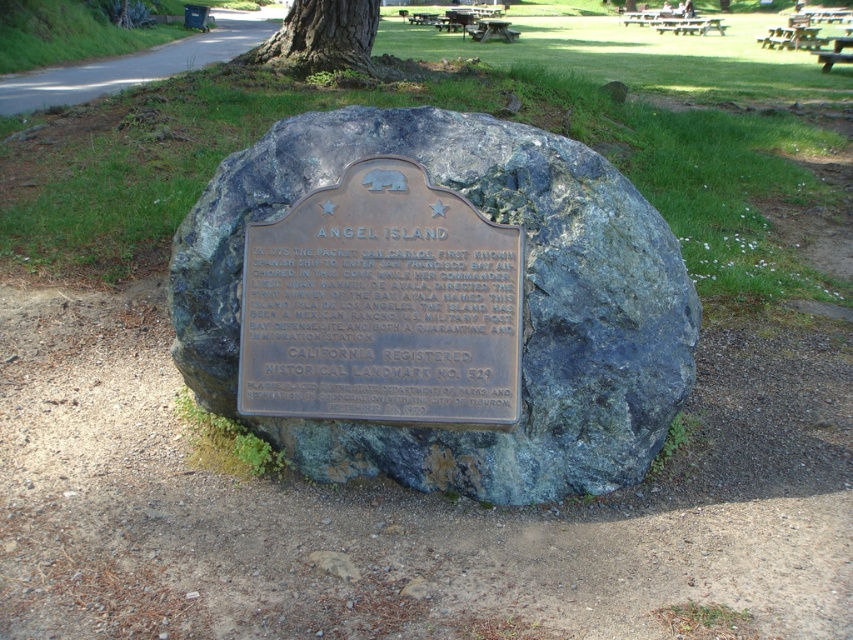
Who is higher up, greenish-blue rock at center or bronze plaque at center?

greenish-blue rock at center

Does greenish-blue rock at center appear on the right side of bronze plaque at center?

Correct, you'll find greenish-blue rock at center to the right of bronze plaque at center.

Is point (613, 488) behind point (372, 237)?

Yes.

This screenshot has width=853, height=640. Find the location of `greenish-blue rock at center`. greenish-blue rock at center is located at coordinates (523, 305).

In the scene shown: Which is below, greenish-blue rock at center or smooth bark tree at center?

Positioned lower is greenish-blue rock at center.

Can you confirm if greenish-blue rock at center is smaller than smooth bark tree at center?

Yes, greenish-blue rock at center is smaller than smooth bark tree at center.

Which is in front, point (663, 369) or point (355, 42)?

Positioned in front is point (663, 369).

The width and height of the screenshot is (853, 640). I want to click on greenish-blue rock at center, so click(523, 305).

Can you confirm if bronze plaque at center is wider than smooth bark tree at center?

In fact, bronze plaque at center might be narrower than smooth bark tree at center.

Based on the photo, who is shorter, bronze plaque at center or smooth bark tree at center?

bronze plaque at center is shorter.

At what (x,y) coordinates should I click in order to perform the action: click on bronze plaque at center. Please return your answer as a coordinate pair (x, y). This screenshot has height=640, width=853. Looking at the image, I should click on (381, 317).

This screenshot has height=640, width=853. What are the coordinates of `bronze plaque at center` in the screenshot? It's located at (381, 317).